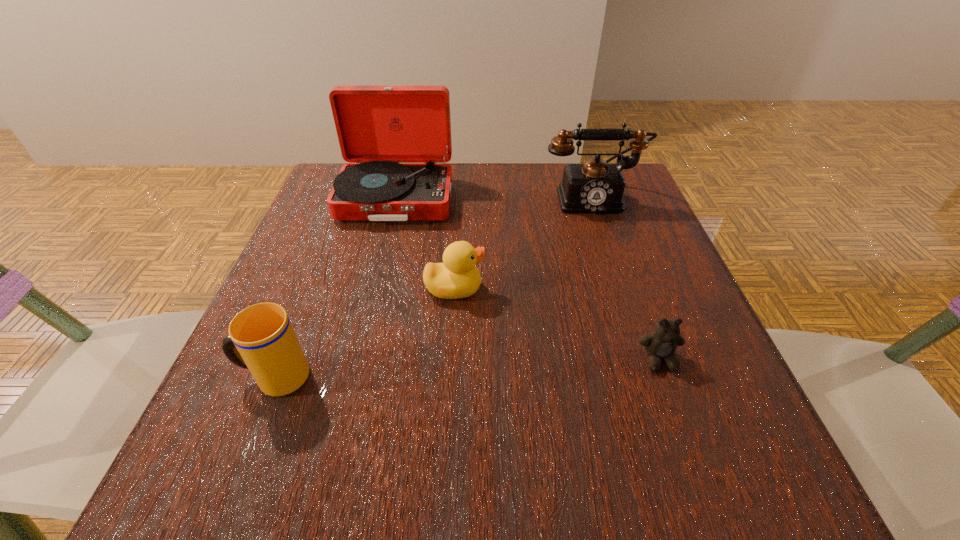
The width and height of the screenshot is (960, 540). I want to click on phonograph_record, so click(397, 139).

The image size is (960, 540). I want to click on the second tallest object, so click(x=593, y=187).

Image resolution: width=960 pixels, height=540 pixels. In order to click on the third shortest object in this screenshot , I will do `click(267, 345)`.

Find the location of a particular element. This screenshot has width=960, height=540. the second shortest object is located at coordinates (457, 277).

The image size is (960, 540). I want to click on duck, so click(x=457, y=277).

Where is `teddy bear`? teddy bear is located at coordinates (661, 344).

Image resolution: width=960 pixels, height=540 pixels. Find the location of `vacant space located 0.200m on the front-facing side of the phonograph_record`. vacant space located 0.200m on the front-facing side of the phonograph_record is located at coordinates (372, 293).

What are the coordinates of `free space located on the front of the fourth shortest object at the rotary dial` in the screenshot? It's located at (618, 278).

The width and height of the screenshot is (960, 540). Find the location of `vacant space located at the beak of the second shortest object`. vacant space located at the beak of the second shortest object is located at coordinates (517, 288).

Find the location of a particular element. vacant space located 0.100m on the face of the shortest object is located at coordinates (686, 436).